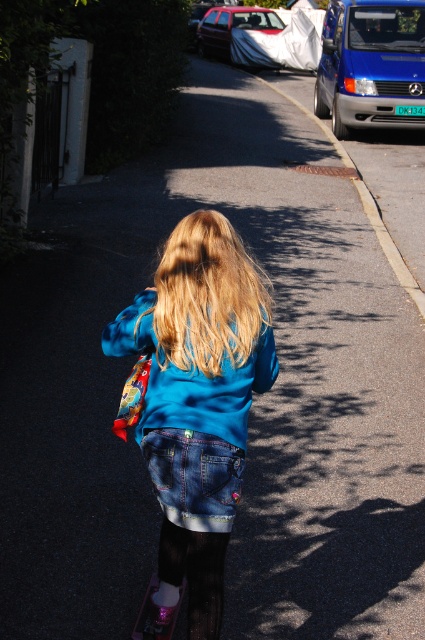
Based on the photo, can you confirm if blonde silky hair at center is shorter than blue metallic van at upper right?

Yes, blonde silky hair at center is shorter than blue metallic van at upper right.

Is point (252, 294) farther from camera compared to point (367, 0)?

No, (252, 294) is closer to viewer.

I want to click on blonde silky hair at center, so click(x=207, y=296).

This screenshot has width=425, height=640. I want to click on blonde silky hair at center, so click(207, 296).

Based on the photo, can you confirm if blue denim jacket at center is positioned below pink glittery skateboard at lower center?

No.

Which is in front, point (167, 321) or point (150, 588)?

Positioned in front is point (167, 321).

Locate an element on the screen. blue denim jacket at center is located at coordinates (197, 403).

The width and height of the screenshot is (425, 640). Describe the element at coordinates (197, 403) in the screenshot. I see `blue denim jacket at center` at that location.

Is the position of blue denim jacket at center less distant than that of white matte car at upper center?

That is True.

Who is more forward, (209, 484) or (246, 26)?

Point (209, 484) is in front.

The width and height of the screenshot is (425, 640). I want to click on blue denim jacket at center, so click(197, 403).